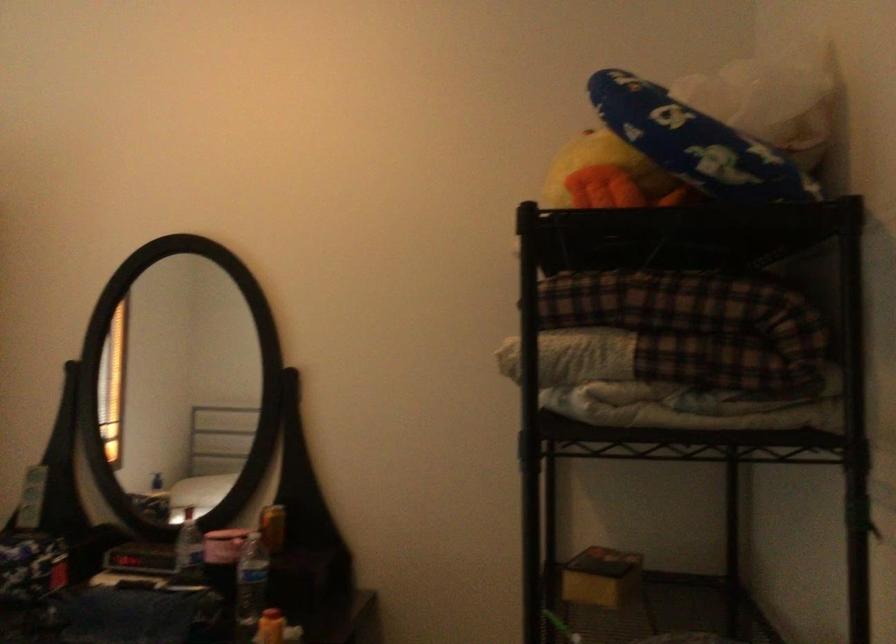
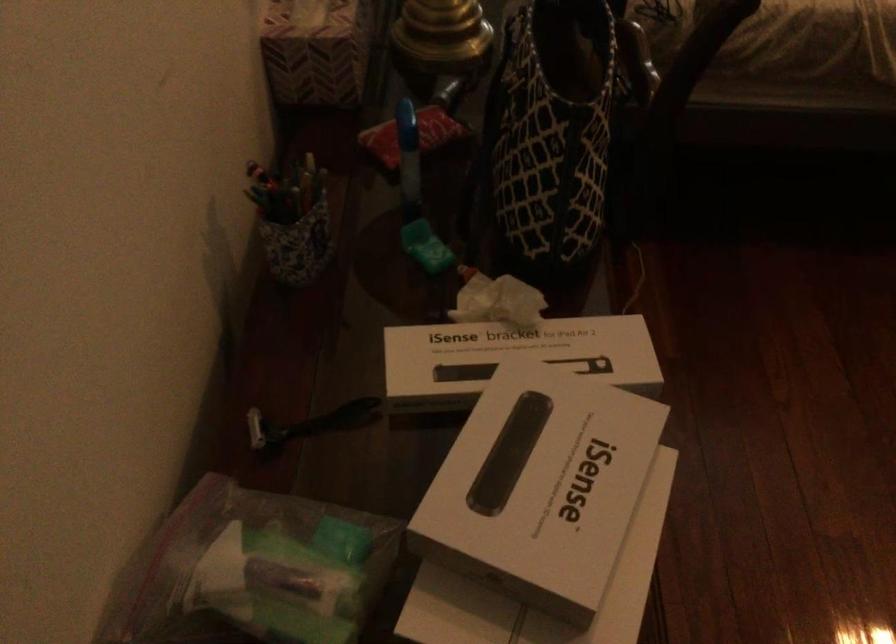
The first image is from the beginning of the video and the second image is from the end. How did the camera likely rotate when shooting the video?

The rotation direction of the camera is left-down.